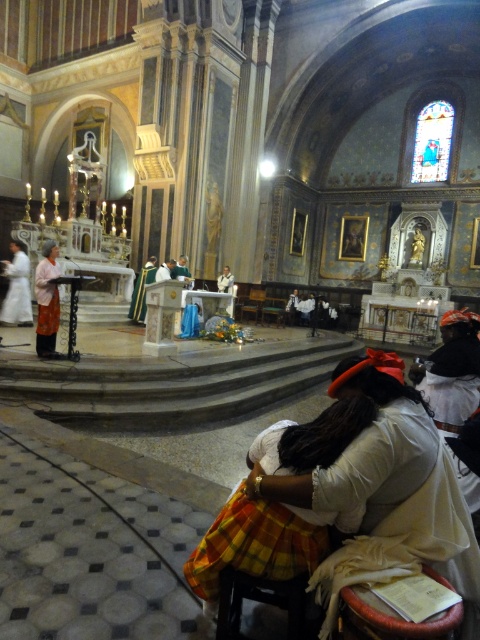
You are an usher in the church and need to guide a visitor to the front pew. The visitor asks where the green velvet robe at center is located relative to the white cotton dress at lower right. What do you tell them?

The green velvet robe at center is to the left of the white cotton dress at lower right.

You are standing at the entrance of the church and see the point marked at coordinates (x=384, y=490). What object is this point located on?

The point at coordinates (x=384, y=490) is located on the white cotton dress at lower right.